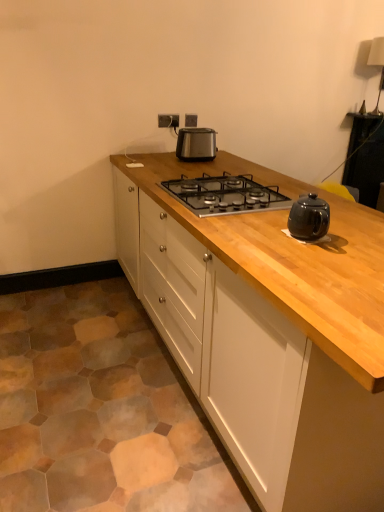
Find the location of a particular element. The width and height of the screenshot is (384, 512). satin black toaster at center is located at coordinates pyautogui.click(x=196, y=144).

What do you see at coordinates (224, 195) in the screenshot?
I see `black glass gas stove at center` at bounding box center [224, 195].

Describe the element at coordinates (268, 330) in the screenshot. This screenshot has height=512, width=384. I see `natural wood cabinet at center` at that location.

What is the approximate width of natural wood cabinet at center?

natural wood cabinet at center is 35.07 inches in width.

Find the location of a particular element. This screenshot has width=384, height=512. satin silver outlet at upper center is located at coordinates (168, 121).

Can satin black toaster at center be found inside satin silver outlet at upper center?

No, satin black toaster at center is not inside satin silver outlet at upper center.

From the image's perspective, is satin silver outlet at upper center located above satin black toaster at center?

Yes, from the image's perspective, satin silver outlet at upper center is on top of satin black toaster at center.

Which object is positioned more to the left, satin silver outlet at upper center or satin black toaster at center?

satin silver outlet at upper center is more to the left.

Who is shorter, satin silver outlet at upper center or satin black toaster at center?

satin silver outlet at upper center.

Looking at this image, does natural wood cabinet at center have a greater height compared to satin silver outlet at upper center?

Indeed, natural wood cabinet at center has a greater height compared to satin silver outlet at upper center.

Is natural wood cabinet at center next to satin silver outlet at upper center and touching it?

No, natural wood cabinet at center is not beside satin silver outlet at upper center.

From a real-world perspective, is natural wood cabinet at center on satin silver outlet at upper center?

No, from a real-world perspective, natural wood cabinet at center is not above satin silver outlet at upper center.

How many degrees apart are the facing directions of natural wood cabinet at center and satin silver outlet at upper center?

natural wood cabinet at center and satin silver outlet at upper center are facing 90 degrees away from each other.

Looking at this image, which object is closer to the camera taking this photo, black glass gas stove at center or satin silver outlet at upper center?

black glass gas stove at center.

Can you tell me how much black glass gas stove at center and satin silver outlet at upper center differ in facing direction?

90 degrees.

Can you confirm if black glass gas stove at center is positioned to the left of satin silver outlet at upper center?

No, black glass gas stove at center is not to the left of satin silver outlet at upper center.

Considering the sizes of objects black glass gas stove at center and satin silver outlet at upper center in the image provided, who is taller, black glass gas stove at center or satin silver outlet at upper center?

satin silver outlet at upper center is taller.

Which is more to the left, satin silver outlet at upper center or black glass gas stove at center?

satin silver outlet at upper center.

In the scene shown: From the image's perspective, which one is positioned higher, satin silver outlet at upper center or black glass gas stove at center?

From the image's view, satin silver outlet at upper center is above.

How far apart are satin silver outlet at upper center and black glass gas stove at center?

They are 1.13 meters apart.

Is satin silver outlet at upper center in contact with black glass gas stove at center?

No, satin silver outlet at upper center is not beside black glass gas stove at center.

Is satin silver outlet at upper center taller than natural wood cabinet at center?

Incorrect, the height of satin silver outlet at upper center is not larger of that of natural wood cabinet at center.

Is natural wood cabinet at center at the back of satin silver outlet at upper center?

No, satin silver outlet at upper center is not facing the opposite direction of natural wood cabinet at center.

From a real-world perspective, is satin silver outlet at upper center positioned under natural wood cabinet at center based on gravity?

Incorrect, from a real-world perspective, satin silver outlet at upper center is higher than natural wood cabinet at center.

Is natural wood cabinet at center located within satin silver outlet at upper center?

No, natural wood cabinet at center is not surrounded by satin silver outlet at upper center.

Does point (202, 158) come in front of point (209, 179)?

No.

From a real-world perspective, is satin black toaster at center on black glass gas stove at center?

Yes.

Considering the sizes of satin black toaster at center and black glass gas stove at center in the image, is satin black toaster at center taller or shorter than black glass gas stove at center?

In the image, satin black toaster at center appears to be taller than black glass gas stove at center.

In order to click on gas stove in front of the satin black toaster at center in this screenshot , I will do `click(224, 195)`.

Choose the correct answer: Is black glass gas stove at center inside satin black toaster at center or outside it?

black glass gas stove at center lies outside satin black toaster at center.

Are black glass gas stove at center and satin black toaster at center beside each other?

They are not placed beside each other.

Based on the photo, is black glass gas stove at center turned away from satin black toaster at center?

That's not correct — black glass gas stove at center is not looking away from satin black toaster at center.

Where is `kitchen appliance to the left of black glass gas stove at center`? This screenshot has height=512, width=384. kitchen appliance to the left of black glass gas stove at center is located at coordinates click(196, 144).

This screenshot has width=384, height=512. What are the coordinates of `electric outlet on the left of satin black toaster at center` in the screenshot? It's located at (168, 121).

Where is `electric outlet above the natural wood cabinet at center (from the image's perspective)`? electric outlet above the natural wood cabinet at center (from the image's perspective) is located at coordinates (168, 121).

From the picture: Looking at the image, which one is located further to black glass gas stove at center, natural wood cabinet at center or satin black toaster at center?

Based on the image, satin black toaster at center appears to be further to black glass gas stove at center.

Looking at the image, which one is located further to black glass gas stove at center, satin silver outlet at upper center or satin black toaster at center?

Among the two, satin silver outlet at upper center is located further to black glass gas stove at center.

From the picture: Based on their spatial positions, is natural wood cabinet at center or satin silver outlet at upper center further from black glass gas stove at center?

Among the two, satin silver outlet at upper center is located further to black glass gas stove at center.

From the image, which object appears to be farther from natural wood cabinet at center, satin black toaster at center or black glass gas stove at center?

satin black toaster at center is further to natural wood cabinet at center.

Considering their positions, is satin black toaster at center positioned further to black glass gas stove at center than satin silver outlet at upper center?

satin silver outlet at upper center.

From the image, which object appears to be nearer to black glass gas stove at center, satin silver outlet at upper center or natural wood cabinet at center?

natural wood cabinet at center lies closer to black glass gas stove at center than the other object.

From the image, which object appears to be nearer to satin black toaster at center, natural wood cabinet at center or satin silver outlet at upper center?

Among the two, satin silver outlet at upper center is located nearer to satin black toaster at center.

Looking at the image, which one is located closer to natural wood cabinet at center, satin silver outlet at upper center or black glass gas stove at center?

black glass gas stove at center is positioned closer to the anchor natural wood cabinet at center.

At what (x,y) coordinates should I click in order to perform the action: click on gas stove located between natural wood cabinet at center and satin silver outlet at upper center in the depth direction. Please return your answer as a coordinate pair (x, y). Looking at the image, I should click on (224, 195).

The image size is (384, 512). Find the location of `kitchen appliance between natural wood cabinet at center and satin silver outlet at upper center from front to back`. kitchen appliance between natural wood cabinet at center and satin silver outlet at upper center from front to back is located at coordinates (196, 144).

The image size is (384, 512). Identify the location of gas stove between natural wood cabinet at center and satin black toaster at center from front to back. (224, 195).

At what (x,y) coordinates should I click in order to perform the action: click on kitchen appliance located between black glass gas stove at center and satin silver outlet at upper center in the depth direction. Please return your answer as a coordinate pair (x, y). Image resolution: width=384 pixels, height=512 pixels. Looking at the image, I should click on (196, 144).